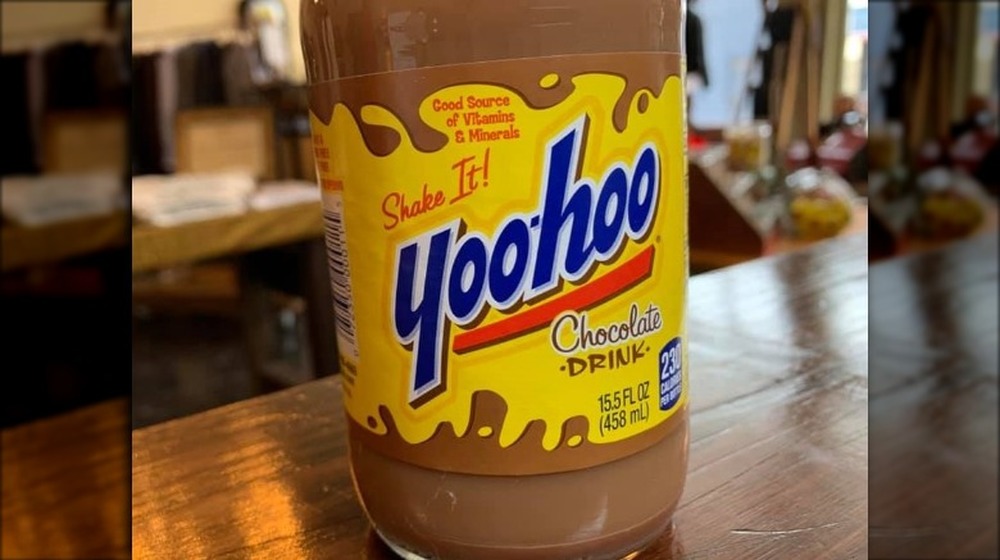
Find the location of a particular element. The height and width of the screenshot is (560, 1000). desk is located at coordinates (217, 238).